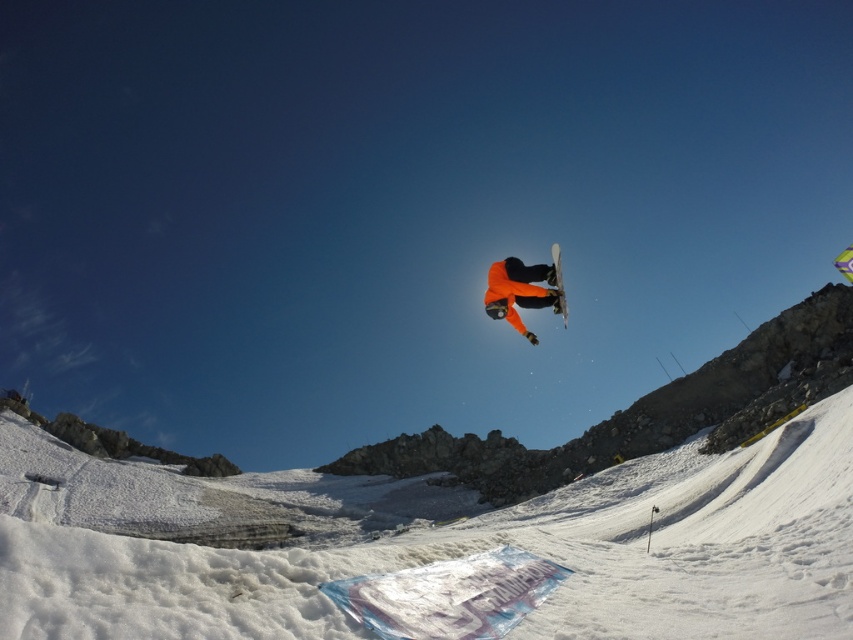
Question: Is orange matte snowboarder at center positioned in front of white matte snowboard at center?

Choices:
 (A) yes
 (B) no

Answer: (A)

Question: Does white powdery snow at center have a greater width compared to white matte snowboard at center?

Choices:
 (A) yes
 (B) no

Answer: (A)

Question: Which of these objects is positioned closest to the white matte snowboard at center?

Choices:
 (A) orange matte snowboarder at center
 (B) white powdery snow at center

Answer: (A)

Question: Is orange matte snowboarder at center positioned in front of white matte snowboard at center?

Choices:
 (A) no
 (B) yes

Answer: (B)

Question: Which point is farther to the camera?

Choices:
 (A) (740, 548)
 (B) (563, 291)
 (C) (550, 289)

Answer: (C)

Question: Considering the real-world distances, which object is closest to the white matte snowboard at center?

Choices:
 (A) orange matte snowboarder at center
 (B) white powdery snow at center

Answer: (A)